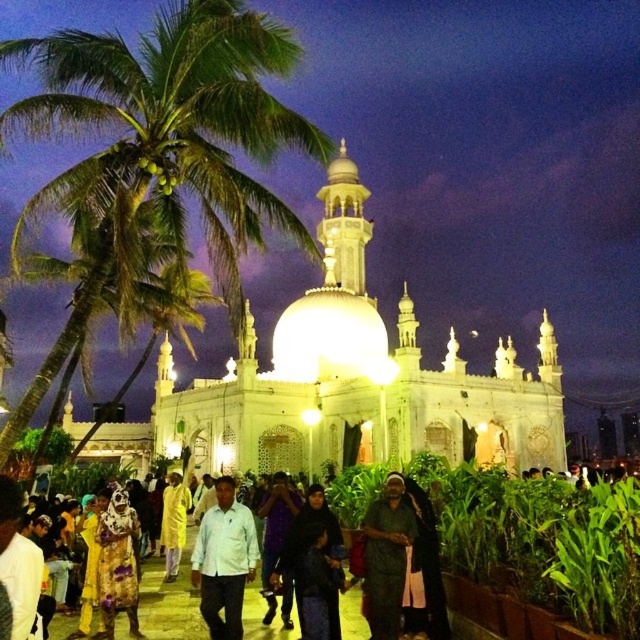
Is white matte shirt at center below dark green fabric at center?

Correct, white matte shirt at center is located below dark green fabric at center.

This screenshot has width=640, height=640. What do you see at coordinates (224, 561) in the screenshot?
I see `white matte shirt at center` at bounding box center [224, 561].

Who is more forward, (218, 516) or (369, 557)?

Point (369, 557)

Locate an element on the screen. The height and width of the screenshot is (640, 640). white matte shirt at center is located at coordinates (224, 561).

Between dark green fabric at lower left and white matte shirt at center, which one is positioned lower?

Positioned lower is white matte shirt at center.

Who is more forward, (141, 573) or (224, 540)?

Point (224, 540) is in front.

Identify the location of dark green fabric at lower left. (170, 600).

Is green leafy palm tree at left to the right of dark green fabric at center from the viewer's perspective?

No, green leafy palm tree at left is not to the right of dark green fabric at center.

Does point (198, 184) come closer to viewer compared to point (376, 568)?

No, it is behind (376, 568).

Identify the location of green leafy palm tree at left. (154, 161).